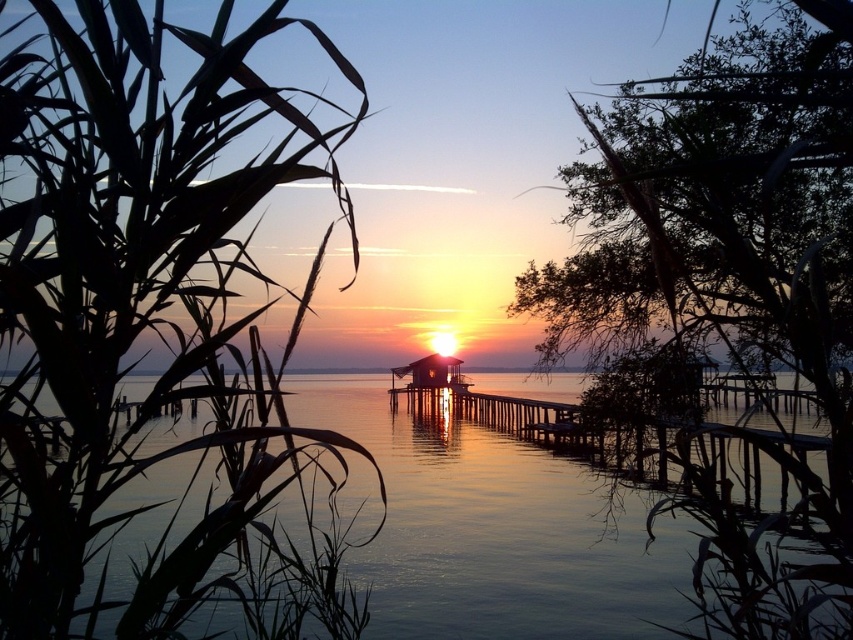
In order to click on silky green leaves at left in this screenshot , I will do `click(155, 337)`.

Locate an element on the screen. silky green leaves at left is located at coordinates (155, 337).

Who is more forward, (157,312) or (807,474)?

Point (157,312) is in front.

Where is `silky green leaves at left`? This screenshot has width=853, height=640. silky green leaves at left is located at coordinates tap(155, 337).

Does point (71, 124) come behind point (694, 492)?

No, it is in front of (694, 492).

In order to click on silky green leaves at left in this screenshot , I will do `click(155, 337)`.

Which is above, green leafy tree at upper right or transparent water at center?

Positioned higher is transparent water at center.

Is green leafy tree at upper right to the left of transparent water at center from the viewer's perspective?

No, green leafy tree at upper right is not to the left of transparent water at center.

Where is `green leafy tree at upper right`? Image resolution: width=853 pixels, height=640 pixels. green leafy tree at upper right is located at coordinates (724, 301).

Find the location of `green leafy tree at upper right`. green leafy tree at upper right is located at coordinates (724, 301).